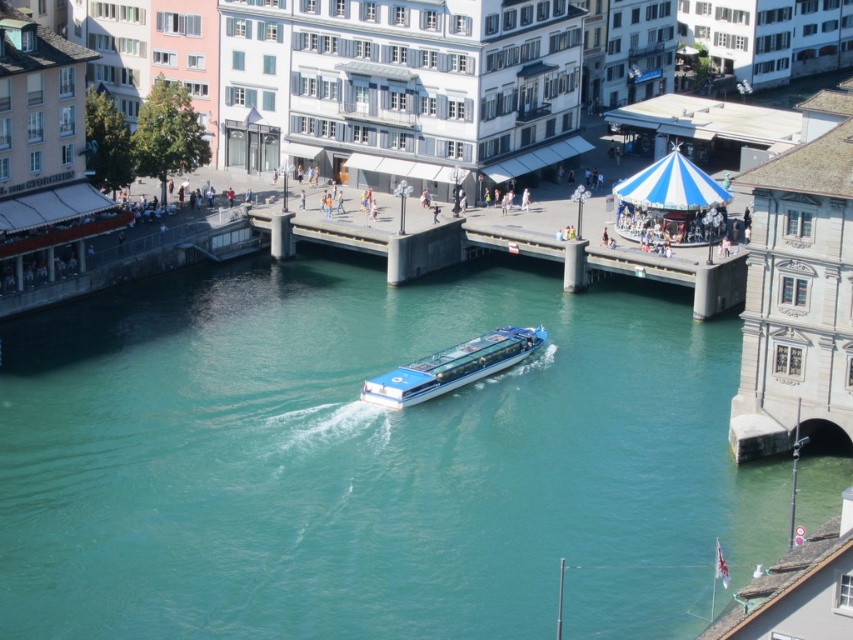
You are a photographer standing on the riverside walkway. You want to capture a photo that includes both the teal glossy water at center and the blue glossy boat at center. Based on their positions, which object should you frame first to ensure both are in the shot?

The teal glossy water at center is to the left of the blue glossy boat at center, so you should frame the teal glossy water at center first on the left side to include both in the photo.

You are standing at the point marked by coordinates (x=369, y=460) in the image. What object is exactly at that location?

The teal glossy water at center is located at point (x=369, y=460).

You are a photographer standing on the riverside walkway. You want to take a photo that includes both the teal glossy water at center and the blue glossy boat at center. Which object should you focus on first to ensure both are in sharp focus?

You should focus on the teal glossy water at center first because it is closer to the viewer than the blue glossy boat at center. By focusing on the closer object, the boat will still be within the depth of field and remain sharp.